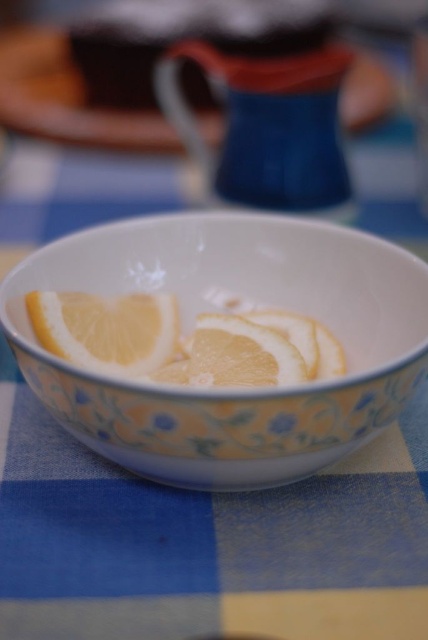
Which is more to the left, yellow matte lemon at center or yellow matte orange at center?

Positioned to the left is yellow matte lemon at center.

Which is behind, point (163, 349) or point (267, 344)?

Positioned behind is point (163, 349).

This screenshot has height=640, width=428. In order to click on yellow matte lemon at center in this screenshot , I will do `click(107, 330)`.

Does white glossy bowl at center appear on the right side of yellow matte lemon at center?

Correct, you'll find white glossy bowl at center to the right of yellow matte lemon at center.

Which is in front, point (256, 301) or point (74, 316)?

Positioned in front is point (74, 316).

Locate an element on the screen. The image size is (428, 640). white glossy bowl at center is located at coordinates (231, 308).

Is white glossy bowl at center to the right of yellow matte orange at center from the viewer's perspective?

Incorrect, white glossy bowl at center is not on the right side of yellow matte orange at center.

Which is in front, point (45, 371) or point (229, 368)?

Point (45, 371)

Is point (175, 480) behind point (258, 342)?

No, it is in front of (258, 342).

The image size is (428, 640). I want to click on white glossy bowl at center, so click(x=231, y=308).